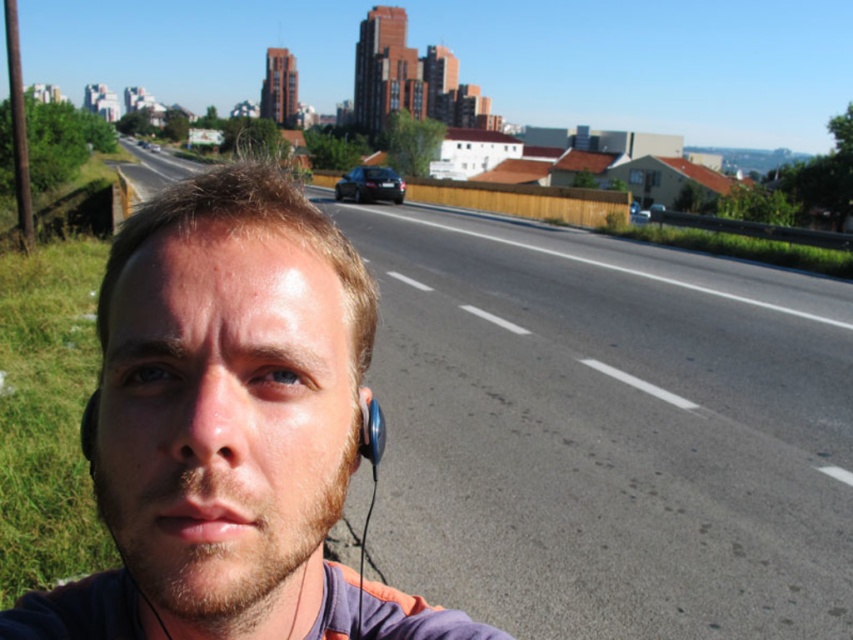
Question: Does smooth skin face at center appear on the right side of satin blue earphone at lower left?

Choices:
 (A) yes
 (B) no

Answer: (B)

Question: Does asphalt road at center have a greater width compared to satin blue earphone at lower left?

Choices:
 (A) no
 (B) yes

Answer: (B)

Question: Which is nearer to the smooth skin face at center?

Choices:
 (A) satin blue earphone at lower left
 (B) asphalt road at center

Answer: (A)

Question: Which is nearer to the satin blue earphone at lower left?

Choices:
 (A) smooth skin face at center
 (B) asphalt road at center

Answer: (A)

Question: Does asphalt road at center have a smaller size compared to satin blue earphone at lower left?

Choices:
 (A) no
 (B) yes

Answer: (A)

Question: Which is farther from the asphalt road at center?

Choices:
 (A) satin blue earphone at lower left
 (B) smooth skin face at center

Answer: (A)